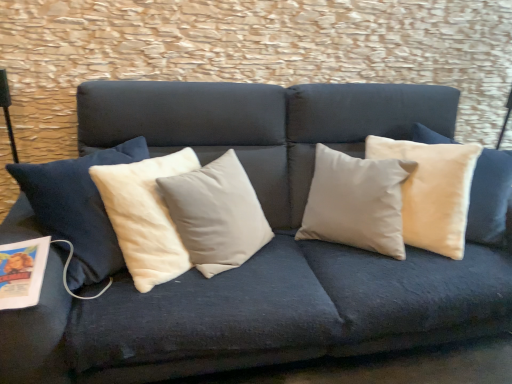
Question: Does beige velvet pillow at upper right have a smaller size compared to matte paper magazine at lower left?

Choices:
 (A) yes
 (B) no

Answer: (B)

Question: Can you confirm if beige velvet pillow at upper right is shorter than matte paper magazine at lower left?

Choices:
 (A) no
 (B) yes

Answer: (A)

Question: Is beige velvet pillow at upper right to the right of matte paper magazine at lower left from the viewer's perspective?

Choices:
 (A) no
 (B) yes

Answer: (B)

Question: Is beige velvet pillow at upper right positioned behind matte paper magazine at lower left?

Choices:
 (A) no
 (B) yes

Answer: (B)

Question: Are beige velvet pillow at upper right and matte paper magazine at lower left making contact?

Choices:
 (A) yes
 (B) no

Answer: (B)

Question: Does beige velvet pillow at upper right appear on the left side of matte paper magazine at lower left?

Choices:
 (A) yes
 (B) no

Answer: (B)

Question: Is matte paper magazine at lower left bigger than beige velvet pillow at upper right?

Choices:
 (A) no
 (B) yes

Answer: (A)

Question: Does matte paper magazine at lower left appear on the left side of beige velvet pillow at upper right?

Choices:
 (A) no
 (B) yes

Answer: (B)

Question: Can you see matte paper magazine at lower left touching beige velvet pillow at upper right?

Choices:
 (A) yes
 (B) no

Answer: (B)

Question: Is matte paper magazine at lower left outside of beige velvet pillow at upper right?

Choices:
 (A) no
 (B) yes

Answer: (B)

Question: From the image's perspective, does matte paper magazine at lower left appear higher than beige velvet pillow at upper right?

Choices:
 (A) no
 (B) yes

Answer: (A)

Question: Can you confirm if matte paper magazine at lower left is shorter than beige velvet pillow at upper right?

Choices:
 (A) yes
 (B) no

Answer: (A)

Question: Considering the positions of beige velvet pillow at upper right and matte paper magazine at lower left in the image, is beige velvet pillow at upper right taller or shorter than matte paper magazine at lower left?

Choices:
 (A) tall
 (B) short

Answer: (A)